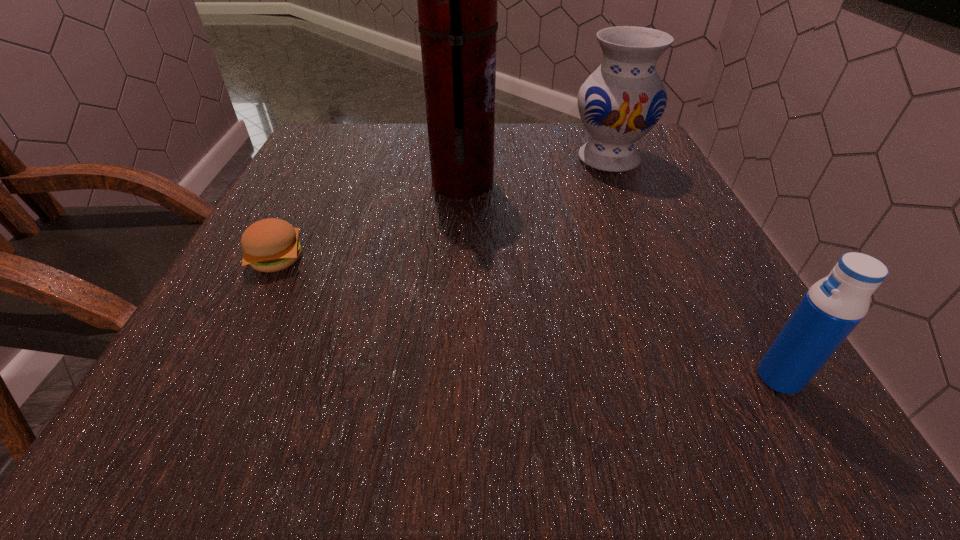
Where is `free spot that satisfies the following two spatial constraints: 1. on the front side of the third tallest object; 2. on the right side of the third shortest object`? free spot that satisfies the following two spatial constraints: 1. on the front side of the third tallest object; 2. on the right side of the third shortest object is located at coordinates (705, 377).